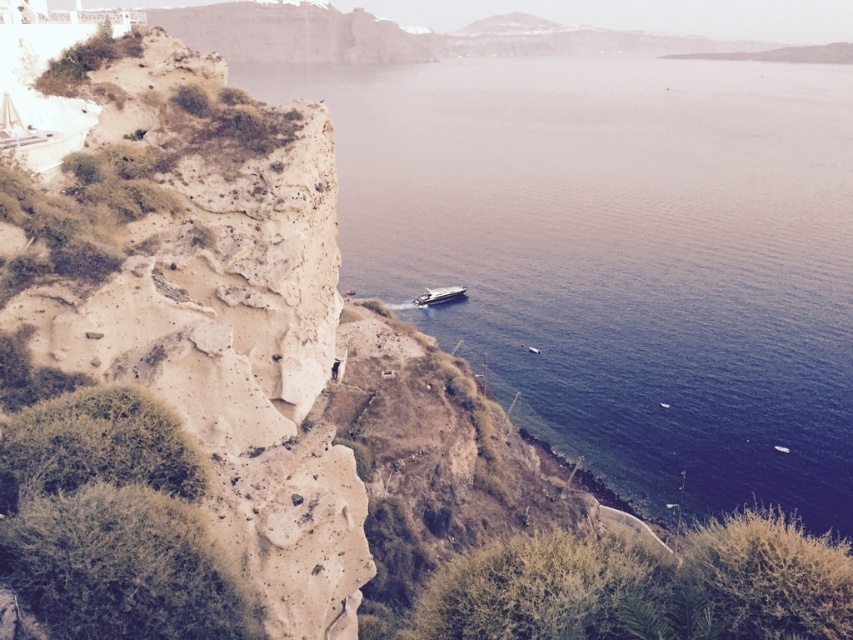
Question: Is beige rock at left to the right of metallic silver boat at center from the viewer's perspective?

Choices:
 (A) yes
 (B) no

Answer: (B)

Question: Estimate the real-world distances between objects in this image. Which object is farther from the blue water at center?

Choices:
 (A) metallic silver boat at center
 (B) beige rock at left

Answer: (B)

Question: Where is blue water at center located in relation to beige rock at left in the image?

Choices:
 (A) right
 (B) left

Answer: (A)

Question: Is the position of blue water at center less distant than that of beige rock at left?

Choices:
 (A) no
 (B) yes

Answer: (A)

Question: Which point is farther from the camera taking this photo?

Choices:
 (A) 567,358
 (B) 451,289
 (C) 77,234

Answer: (B)

Question: Which object is the farthest from the beige rock at left?

Choices:
 (A) blue water at center
 (B) metallic silver boat at center

Answer: (A)